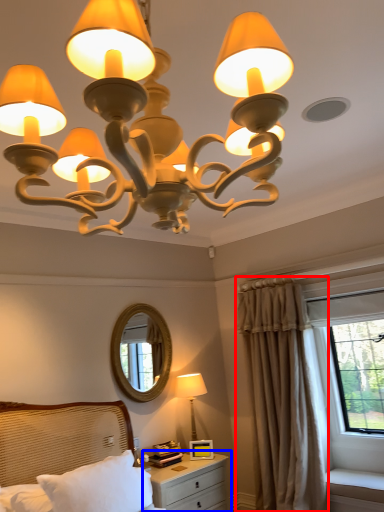
Question: Among these objects, which one is farthest to the camera, curtain (highlighted by a red box) or nightstand (highlighted by a blue box)?

Choices:
 (A) curtain
 (B) nightstand

Answer: (A)